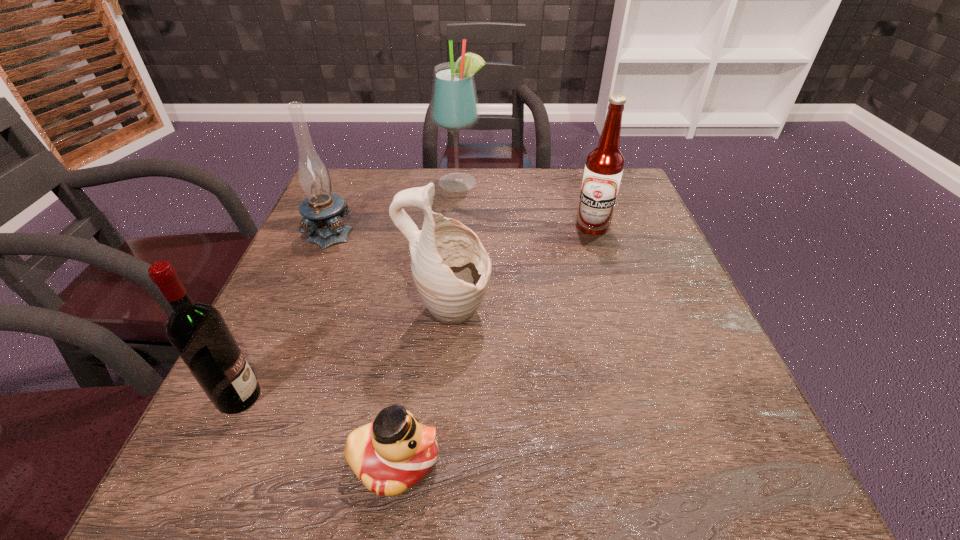
At what (x,y) coordinates should I click in order to perform the action: click on empty space that is in between the third nearest object and the oil lamp. Please return your answer as a coordinate pair (x, y). The height and width of the screenshot is (540, 960). Looking at the image, I should click on point(390,273).

This screenshot has width=960, height=540. I want to click on empty space between the leftmost alcohol and the tallest object, so click(349, 290).

At what (x,y) coordinates should I click in order to perform the action: click on unoccupied position between the nearest alcohol and the oil lamp. Please return your answer as a coordinate pair (x, y). Looking at the image, I should click on (285, 314).

Where is `free spot between the second farthest alcohol and the duck`? This screenshot has height=540, width=960. free spot between the second farthest alcohol and the duck is located at coordinates (493, 343).

Where is `empty space that is in between the shortest object and the pitcher`? Image resolution: width=960 pixels, height=540 pixels. empty space that is in between the shortest object and the pitcher is located at coordinates (421, 388).

The image size is (960, 540). I want to click on object identified as the fifth closest to the nearest alcohol, so click(604, 165).

Where is `the fourth closest object to the rightmost alcohol`? The width and height of the screenshot is (960, 540). the fourth closest object to the rightmost alcohol is located at coordinates (394, 452).

This screenshot has width=960, height=540. What are the coordinates of `the third closest alcohol to the fourth farthest object` in the screenshot? It's located at (454, 108).

At what (x,y) coordinates should I click in order to perform the action: click on alcohol that is the closest to the third nearest object. Please return your answer as a coordinate pair (x, y). The image size is (960, 540). Looking at the image, I should click on (198, 332).

This screenshot has width=960, height=540. I want to click on free space that satisfies the following two spatial constraints: 1. on the label side of the rightmost object; 2. on the front and back of the nearest alcohol, so click(647, 397).